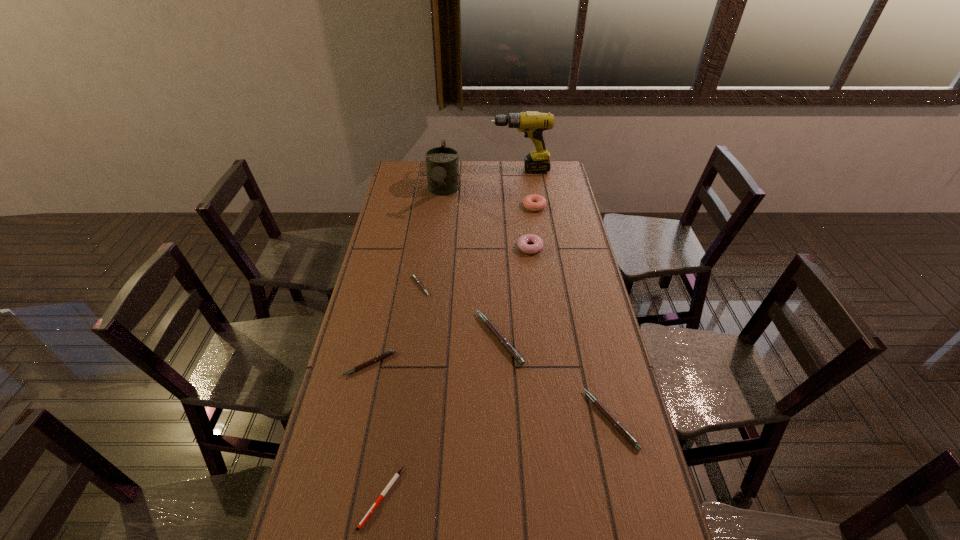
In the image, there is a desktop. Where is `vacant space at the far right corner`? This screenshot has height=540, width=960. vacant space at the far right corner is located at coordinates (558, 174).

The image size is (960, 540). Identify the location of free spot between the nearest object and the purple doughnut. (456, 373).

Identify the location of free space between the tallest object and the seventh tallest object. (444, 267).

The height and width of the screenshot is (540, 960). In order to click on vacant space that is in between the third shortest object and the watering can in this screenshot , I will do `click(406, 278)`.

Image resolution: width=960 pixels, height=540 pixels. I want to click on free space between the second pen from right to left and the second tallest object, so click(x=471, y=265).

Identify the location of free area in between the third biggest pink pen and the fourth shortest object. Image resolution: width=960 pixels, height=540 pixels. (490, 392).

Identify the location of free space between the nearer doughnut and the second smallest pink pen. (449, 306).

This screenshot has width=960, height=540. In order to click on blank region between the tallest pen and the third smallest pink pen in this screenshot , I will do `click(555, 379)`.

The image size is (960, 540). In order to click on vacant space that is in between the white pen and the sixth nearest object in this screenshot , I will do `click(456, 373)`.

Where is `object that ranks as the closest to the farther doughnut`? object that ranks as the closest to the farther doughnut is located at coordinates (537, 245).